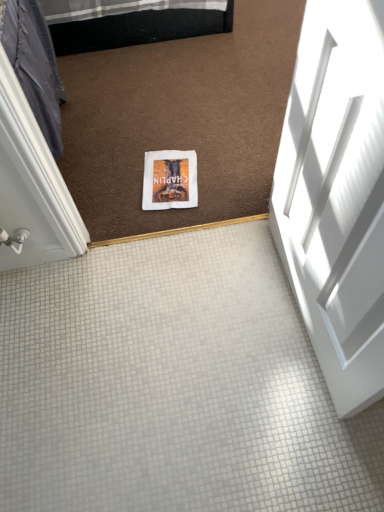
Where is `free location in front of white glossy door at right`? The image size is (384, 512). free location in front of white glossy door at right is located at coordinates (283, 419).